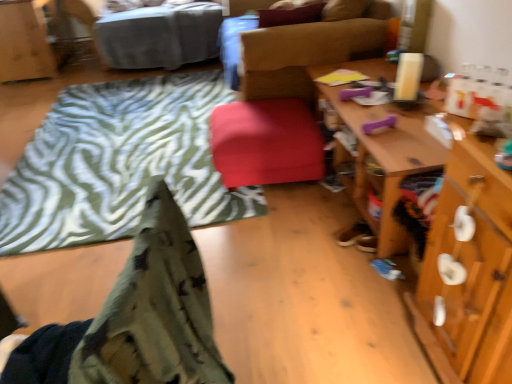
Find the location of a particular element. velvet-like brown chair at center is located at coordinates (285, 100).

What do you see at coordinates (470, 271) in the screenshot? I see `wooden desk at right` at bounding box center [470, 271].

Locate an element on the screen. The image size is (512, 384). gray fabric bed at upper left is located at coordinates click(153, 34).

Which object is further away from the camera taking this photo, zebra-patterned fabric at lower left, the 2th blanket in the front-to-back sequence, or gray fabric bed at upper left?

gray fabric bed at upper left is more distant.

From the picture: Which of these two, zebra-patterned fabric at lower left, the first blanket positioned from the back, or gray fabric bed at upper left, is bigger?

Bigger between the two is gray fabric bed at upper left.

Considering the positions of objects zebra-patterned fabric at lower left, the 2th blanket in the front-to-back sequence, and gray fabric bed at upper left in the image provided, who is more to the left, zebra-patterned fabric at lower left, the 2th blanket in the front-to-back sequence, or gray fabric bed at upper left?

gray fabric bed at upper left is more to the left.

Based on the photo, is zebra-patterned fabric at lower left, the 2th blanket in the front-to-back sequence, directly adjacent to gray fabric bed at upper left?

zebra-patterned fabric at lower left, the 2th blanket in the front-to-back sequence, and gray fabric bed at upper left are not in contact.

From a real-world perspective, is matte red stool at center under zebra-patterned fabric at lower left, the 2th blanket in the front-to-back sequence?

No, from a real-world perspective, matte red stool at center is not beneath zebra-patterned fabric at lower left, the 2th blanket in the front-to-back sequence.

Which object is thinner, matte red stool at center or zebra-patterned fabric at lower left, the first blanket positioned from the back?

matte red stool at center.

What's the angular difference between matte red stool at center and zebra-patterned fabric at lower left, the first blanket positioned from the back,'s facing directions?

The angular difference between matte red stool at center and zebra-patterned fabric at lower left, the first blanket positioned from the back, is 3.98 degrees.

Considering the sizes of matte red stool at center and zebra-patterned fabric at lower left, the first blanket positioned from the back, in the image, is matte red stool at center bigger or smaller than zebra-patterned fabric at lower left, the first blanket positioned from the back,?

In the image, matte red stool at center appears to be smaller than zebra-patterned fabric at lower left, the first blanket positioned from the back.

Is wooden desk at right positioned behind zebra-patterned fabric at lower left, the 2th blanket in the front-to-back sequence?

No, it is not.

From the image's perspective, is wooden desk at right beneath zebra-patterned fabric at lower left, the 2th blanket in the front-to-back sequence?

Indeed, from the image's perspective, wooden desk at right is shown beneath zebra-patterned fabric at lower left, the 2th blanket in the front-to-back sequence.

Is wooden desk at right positioned beyond the bounds of zebra-patterned fabric at lower left, the 2th blanket in the front-to-back sequence?

That's correct, wooden desk at right is outside of zebra-patterned fabric at lower left, the 2th blanket in the front-to-back sequence.

Locate an element on the screen. This screenshot has width=512, height=384. desk below the zebra-patterned fabric at lower left, the first blanket positioned from the back (from the image's perspective) is located at coordinates (470, 271).

Is matte red stool at center with soft green fleece blanket at lower left, positioned as the 1th blanket in front-to-back order?

No.

How different are the orientations of matte red stool at center and soft green fleece blanket at lower left, positioned as the 1th blanket in front-to-back order, in degrees?

They differ by 6.41 degrees in their facing directions.

Could you tell me if matte red stool at center is facing soft green fleece blanket at lower left, positioned as the 1th blanket in front-to-back order?

No, matte red stool at center is not aimed at soft green fleece blanket at lower left, positioned as the 1th blanket in front-to-back order.

Between velvet-like brown chair at center and wooden cabinet at upper left, which one has smaller size?

wooden cabinet at upper left is smaller.

Consider the image. From a real-world perspective, is velvet-like brown chair at center on wooden cabinet at upper left?

Indeed, from a real-world perspective, velvet-like brown chair at center stands above wooden cabinet at upper left.

From the picture: Does velvet-like brown chair at center have a greater height compared to wooden cabinet at upper left?

No, velvet-like brown chair at center is not taller than wooden cabinet at upper left.

Considering the sizes of objects velvet-like brown chair at center and wooden cabinet at upper left in the image provided, who is thinner, velvet-like brown chair at center or wooden cabinet at upper left?

wooden cabinet at upper left is thinner.

Which object is positioned more to the left, matte red stool at center or wooden cabinet at upper left?

From the viewer's perspective, wooden cabinet at upper left appears more on the left side.

Is matte red stool at center bigger than wooden cabinet at upper left?

Incorrect, matte red stool at center is not larger than wooden cabinet at upper left.

Is matte red stool at center facing towards wooden cabinet at upper left?

No, matte red stool at center is not turned towards wooden cabinet at upper left.

Based on the photo, considering the positions of objects zebra-patterned fabric at lower left, the 2th blanket in the front-to-back sequence, and wooden cabinet at upper left in the image provided, who is behind, zebra-patterned fabric at lower left, the 2th blanket in the front-to-back sequence, or wooden cabinet at upper left?

wooden cabinet at upper left is further from the camera.

Is point (121, 168) closer to camera compared to point (42, 73)?

Yes, point (121, 168) is closer to viewer.

Does zebra-patterned fabric at lower left, the first blanket positioned from the back, have a greater height compared to wooden cabinet at upper left?

Incorrect, the height of zebra-patterned fabric at lower left, the first blanket positioned from the back, is not larger of that of wooden cabinet at upper left.

From the image's perspective, is zebra-patterned fabric at lower left, the 2th blanket in the front-to-back sequence, positioned above or below wooden cabinet at upper left?

From the image's perspective, zebra-patterned fabric at lower left, the 2th blanket in the front-to-back sequence, appears below wooden cabinet at upper left.

Locate an element on the screen. This screenshot has width=512, height=384. the 1st blanket to the right of the gray fabric bed at upper left, counting from the anchor's position is located at coordinates (119, 163).

At what (x,y) coordinates should I click in order to perform the action: click on stool that is below the zebra-patterned fabric at lower left, the 2th blanket in the front-to-back sequence (from the image's perspective). Please return your answer as a coordinate pair (x, y). This screenshot has height=384, width=512. Looking at the image, I should click on pyautogui.click(x=266, y=142).

When comparing their distances from zebra-patterned fabric at lower left, the 2th blanket in the front-to-back sequence, does velvet-like brown chair at center or gray fabric bed at upper left seem closer?

velvet-like brown chair at center is closer to zebra-patterned fabric at lower left, the 2th blanket in the front-to-back sequence.

Estimate the real-world distances between objects in this image. Which object is further from matte red stool at center, zebra-patterned fabric at lower left, the first blanket positioned from the back, or wooden desk at right?

Among the two, zebra-patterned fabric at lower left, the first blanket positioned from the back, is located further to matte red stool at center.

Looking at this image, from the image, which object appears to be nearer to soft green fleece blanket at lower left, the 2th blanket viewed from the back, gray fabric bed at upper left or zebra-patterned fabric at lower left, the 2th blanket in the front-to-back sequence?

The object closer to soft green fleece blanket at lower left, the 2th blanket viewed from the back, is zebra-patterned fabric at lower left, the 2th blanket in the front-to-back sequence.

Looking at the image, which one is located closer to gray fabric bed at upper left, soft green fleece blanket at lower left, the 2th blanket viewed from the back, or wooden desk at right?

The object closer to gray fabric bed at upper left is wooden desk at right.

When comparing their distances from gray fabric bed at upper left, does velvet-like brown chair at center or wooden cabinet at upper left seem further?

velvet-like brown chair at center is further to gray fabric bed at upper left.

Considering their positions, is wooden desk at right positioned closer to gray fabric bed at upper left than soft green fleece blanket at lower left, positioned as the 1th blanket in front-to-back order?

The object closer to gray fabric bed at upper left is wooden desk at right.

Based on their spatial positions, is gray fabric bed at upper left or matte red stool at center closer to velvet-like brown chair at center?

Among the two, matte red stool at center is located nearer to velvet-like brown chair at center.

Based on their spatial positions, is matte red stool at center or velvet-like brown chair at center closer to soft green fleece blanket at lower left, positioned as the 1th blanket in front-to-back order?

matte red stool at center is positioned closer to the anchor soft green fleece blanket at lower left, positioned as the 1th blanket in front-to-back order.

Find the location of a particular element. The height and width of the screenshot is (384, 512). chair between zebra-patterned fabric at lower left, the 2th blanket in the front-to-back sequence, and gray fabric bed at upper left, along the z-axis is located at coordinates (285, 100).

Locate an element on the screen. The image size is (512, 384). stool positioned between soft green fleece blanket at lower left, positioned as the 1th blanket in front-to-back order, and velvet-like brown chair at center from near to far is located at coordinates (266, 142).

Where is `bed between wooden cabinet at upper left and wooden desk at right from left to right`? The height and width of the screenshot is (384, 512). bed between wooden cabinet at upper left and wooden desk at right from left to right is located at coordinates (153, 34).

Image resolution: width=512 pixels, height=384 pixels. I want to click on chair between soft green fleece blanket at lower left, positioned as the 1th blanket in front-to-back order, and gray fabric bed at upper left from front to back, so click(x=285, y=100).